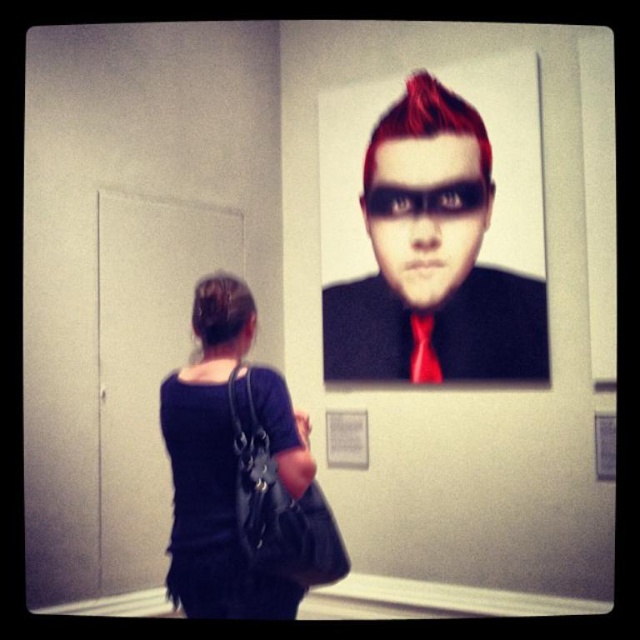
Question: Does shiny black suit at upper center have a greater width compared to dark blue fabric bag at lower left?

Choices:
 (A) yes
 (B) no

Answer: (A)

Question: Estimate the real-world distances between objects in this image. Which object is farther from the dark blue fabric bag at lower left?

Choices:
 (A) black shiny hair at upper center
 (B) red satin tie at upper center

Answer: (B)

Question: Is shiny black suit at upper center closer to the viewer compared to matte black mask at upper center?

Choices:
 (A) no
 (B) yes

Answer: (B)

Question: Which point is closer to the camera?

Choices:
 (A) dark blue fabric bag at lower left
 (B) red satin tie at upper center
 (C) shiny black suit at upper center

Answer: (A)

Question: Among these points, which one is farthest from the camera?

Choices:
 (A) (406, 195)
 (B) (416, 330)
 (C) (218, 349)
 (D) (188, 472)

Answer: (A)

Question: Can you confirm if dark blue fabric bag at lower left is bigger than matte black mask at upper center?

Choices:
 (A) no
 (B) yes

Answer: (B)